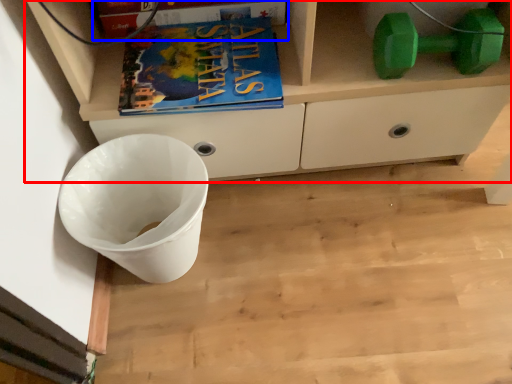
Question: Among these objects, which one is nearest to the camera, cabinetry (highlighted by a red box) or paperback book (highlighted by a blue box)?

Choices:
 (A) cabinetry
 (B) paperback book

Answer: (A)